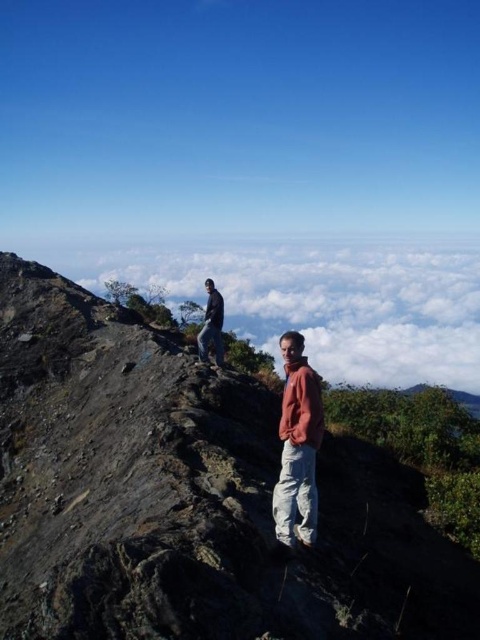
Question: Which point is closer to the camera taking this photo?

Choices:
 (A) (322, 310)
 (B) (216, 336)
 (C) (304, 413)

Answer: (C)

Question: Does white fluffy cloud at upper center have a greater width compared to dark blue jacket at upper left?

Choices:
 (A) yes
 (B) no

Answer: (A)

Question: Can you confirm if rugged rock mountain at center is smaller than dark blue jacket at upper left?

Choices:
 (A) yes
 (B) no

Answer: (B)

Question: Is rugged rock mountain at center behind white fluffy cloud at upper center?

Choices:
 (A) no
 (B) yes

Answer: (A)

Question: Among these points, which one is nearest to the camera?

Choices:
 (A) (275, 499)
 (B) (111, 428)

Answer: (A)

Question: Which object is positioned closest to the rugged rock mountain at center?

Choices:
 (A) white fluffy cloud at upper center
 (B) dark blue jacket at upper left

Answer: (B)